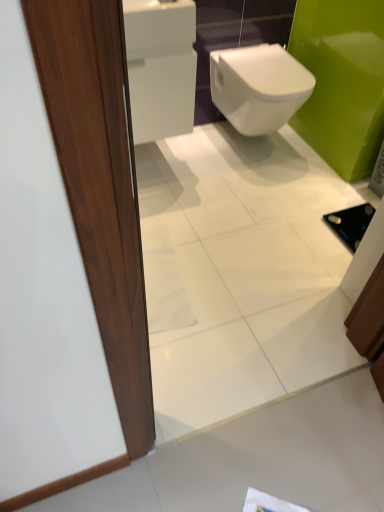
Question: From the image's perspective, is matte wood door at left located above white paper at lower center?

Choices:
 (A) yes
 (B) no

Answer: (A)

Question: Is matte wood door at left not close to white paper at lower center?

Choices:
 (A) yes
 (B) no

Answer: (A)

Question: Considering the relative sizes of matte wood door at left and white paper at lower center in the image provided, is matte wood door at left shorter than white paper at lower center?

Choices:
 (A) no
 (B) yes

Answer: (A)

Question: Is the depth of matte wood door at left less than that of white paper at lower center?

Choices:
 (A) no
 (B) yes

Answer: (B)

Question: Is matte wood door at left at the left side of white paper at lower center?

Choices:
 (A) yes
 (B) no

Answer: (B)

Question: Choose the correct answer: Is white glossy tile at lower left inside white glossy bidet at center or outside it?

Choices:
 (A) inside
 (B) outside

Answer: (B)

Question: From the image's perspective, is white glossy tile at lower left above or below white glossy bidet at center?

Choices:
 (A) above
 (B) below

Answer: (B)

Question: In terms of size, does white glossy tile at lower left appear bigger or smaller than white glossy bidet at center?

Choices:
 (A) big
 (B) small

Answer: (B)

Question: Considering the positions of white glossy tile at lower left and white glossy bidet at center in the image, is white glossy tile at lower left taller or shorter than white glossy bidet at center?

Choices:
 (A) short
 (B) tall

Answer: (A)

Question: Is matte wood door at left wider or thinner than white paper at lower center?

Choices:
 (A) wide
 (B) thin

Answer: (B)

Question: From the image's perspective, is matte wood door at left located above or below white paper at lower center?

Choices:
 (A) below
 (B) above

Answer: (B)

Question: In terms of size, does matte wood door at left appear bigger or smaller than white paper at lower center?

Choices:
 (A) big
 (B) small

Answer: (A)

Question: From a real-world perspective, is matte wood door at left above or below white paper at lower center?

Choices:
 (A) above
 (B) below

Answer: (A)

Question: From their relative heights in the image, would you say white paper at lower center is taller or shorter than matte wood door at left?

Choices:
 (A) short
 (B) tall

Answer: (A)

Question: From the image's perspective, is white paper at lower center located above or below matte wood door at left?

Choices:
 (A) above
 (B) below

Answer: (B)